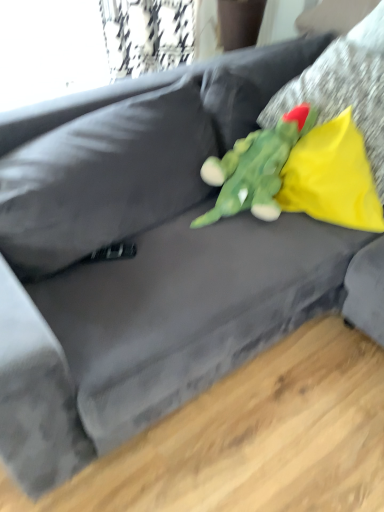
Question: Is yellow fabric pillow at upper right, positioned as the 2th pillow in top-to-bottom order, in front of or behind green plush toy at center in the image?

Choices:
 (A) front
 (B) behind

Answer: (B)

Question: Considering the positions of point (360, 153) and point (246, 190), is point (360, 153) closer or farther from the camera than point (246, 190)?

Choices:
 (A) farther
 (B) closer

Answer: (B)

Question: Considering the real-world distances, which object is closest to the green plush toy at center?

Choices:
 (A) yellow fabric pillow at upper right, the 1th pillow in the bottom-to-top sequence
 (B) yellow fabric pillow at upper right, which ranks as the 2th pillow in bottom-to-top order

Answer: (A)

Question: Estimate the real-world distances between objects in this image. Which object is closer to the yellow fabric pillow at upper right, the 1th pillow in the bottom-to-top sequence?

Choices:
 (A) yellow fabric pillow at upper right, which ranks as the first pillow in top-to-bottom order
 (B) green plush toy at center

Answer: (B)